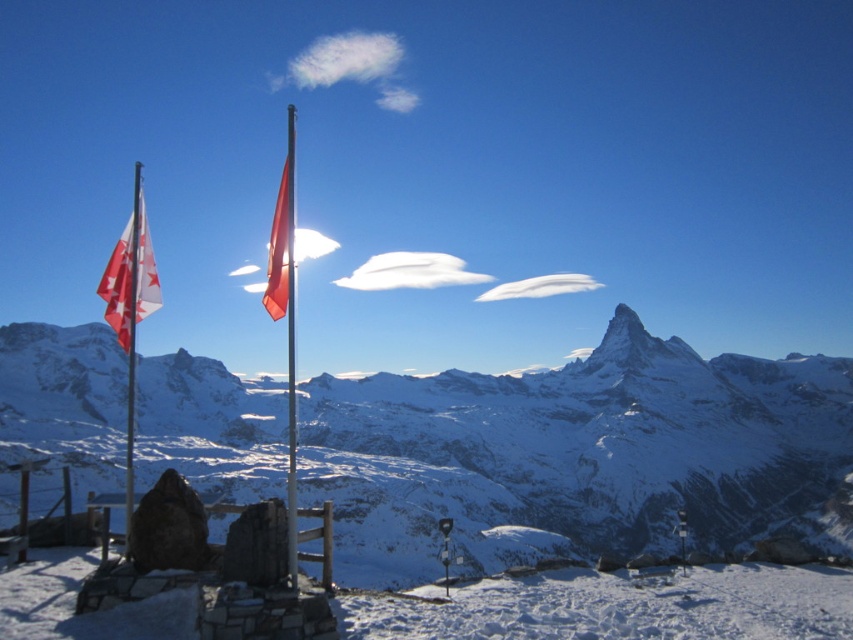
You are a hiker planning to travel from the red fabric flag at left to the red matte flag at center. Given that you can walk 3 miles per hour, how long will it take you to reach the flag?

The distance between the red fabric flag at left and the red matte flag at center is 132.94 feet. Converting this to miles, 132.94 feet is approximately 0.025 miles. At a walking speed of 3 miles per hour, it would take roughly 0.83 minutes, which is about 50 seconds to reach the flag.

Looking at this image, you are standing at the base of the mountain and want to reach the point marked at coordinates point (639, 392). Given that your average walking speed is 3 km per hour, how long will it take you to reach that point?

The point marked at coordinates point (639, 392) is 200.79 meters away from the viewer. At an average walking speed of 3 km per hour, it would take approximately 4 minutes to reach that point.

You are a photographer standing at the base of the stone structure with the two flagpoles. You want to capture a photo of the snowy granite mountain range at upper center. Given that your camera has a maximum zoom range of 100 meters, can you clearly capture the mountain range in your photo?

The snowy granite mountain range at upper center is 75.03 meters away from the camera. Since the camera can zoom up to 100 meters, it is within the maximum range, so yes, you can clearly capture the mountain range in your photo.